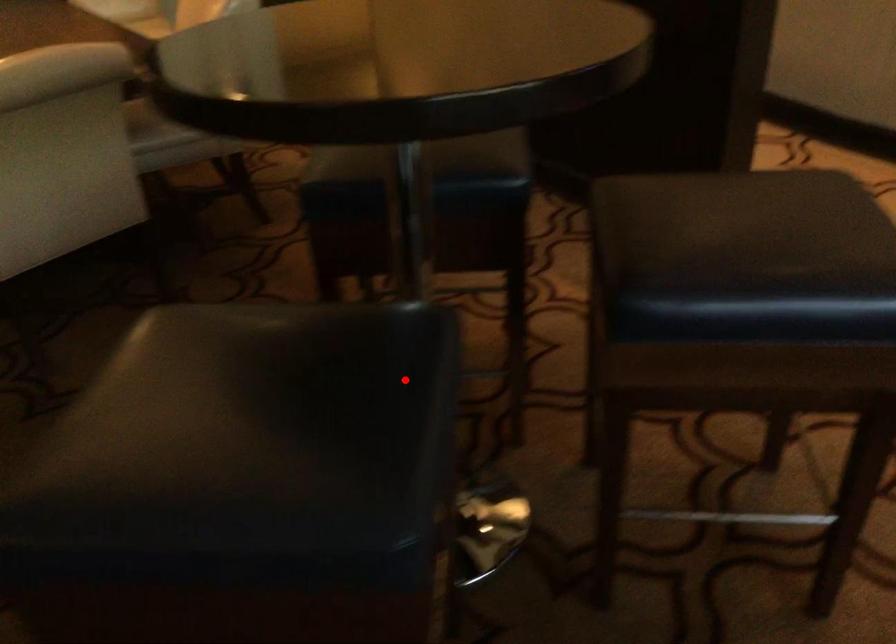
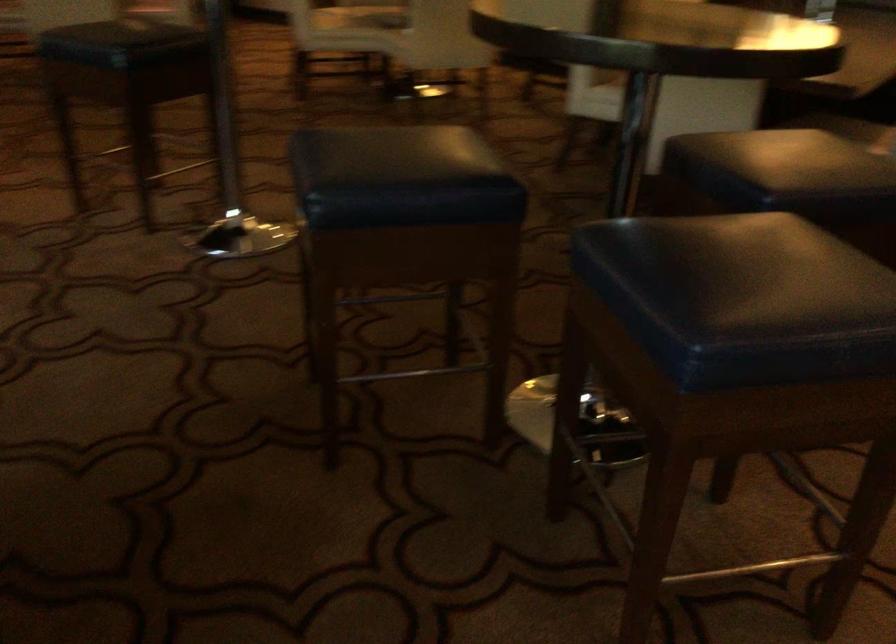
Question: A red point is marked in image1. In image2, is the corresponding 3D point closer to the camera or farther? Reply with the corresponding letter.

Choices:
 (A) The corresponding 3D point is closer.
 (B) The corresponding 3D point is farther.

Answer: (B)